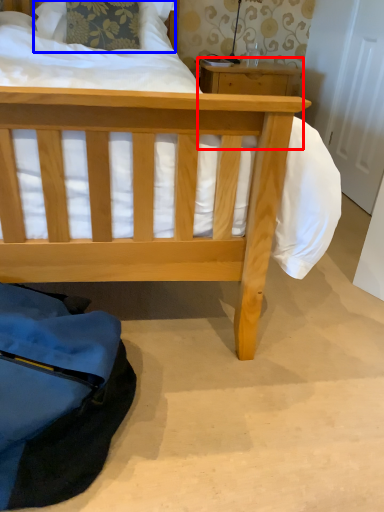
Question: Which point is closer to the camera, table (highlighted by a red box) or pillow (highlighted by a blue box)?

Choices:
 (A) table
 (B) pillow

Answer: (B)